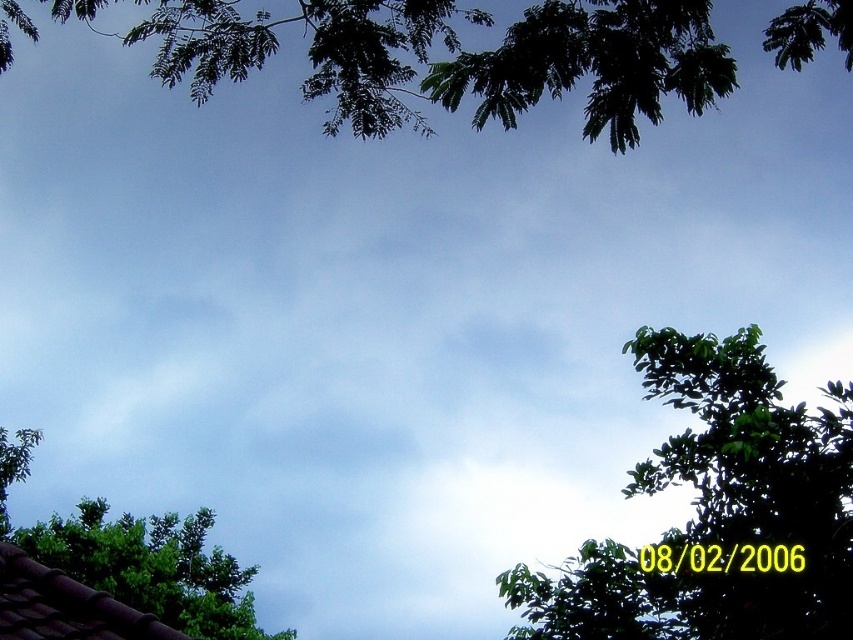
Question: Among these objects, which one is farthest from the camera?

Choices:
 (A) green leafy branches at upper center
 (B) green leafy tree at lower left
 (C) green leafy tree at right

Answer: (B)

Question: Which point appears farthest from the camera in this image?

Choices:
 (A) (689, 20)
 (B) (54, 564)

Answer: (B)

Question: Which point is farther to the camera?

Choices:
 (A) green leafy branches at upper center
 (B) green leafy tree at lower left

Answer: (B)

Question: Does green leafy branches at upper center come in front of green leafy tree at lower left?

Choices:
 (A) yes
 (B) no

Answer: (A)

Question: Is green leafy tree at right positioned in front of green leafy branches at upper center?

Choices:
 (A) no
 (B) yes

Answer: (B)

Question: Where is green leafy branches at upper center located in relation to green leafy tree at lower left in the image?

Choices:
 (A) left
 (B) right

Answer: (B)